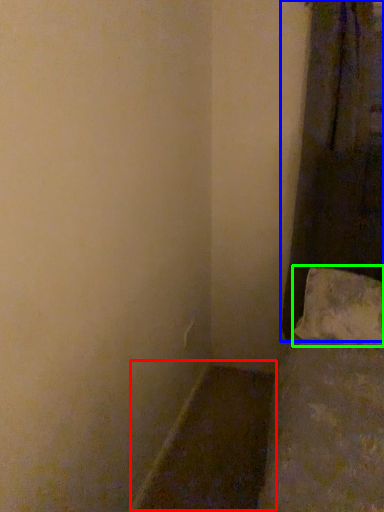
Question: Estimate the real-world distances between objects in this image. Which object is farther from window sill (highlighted by a red box), curtain (highlighted by a blue box) or pillow (highlighted by a green box)?

Choices:
 (A) curtain
 (B) pillow

Answer: (A)